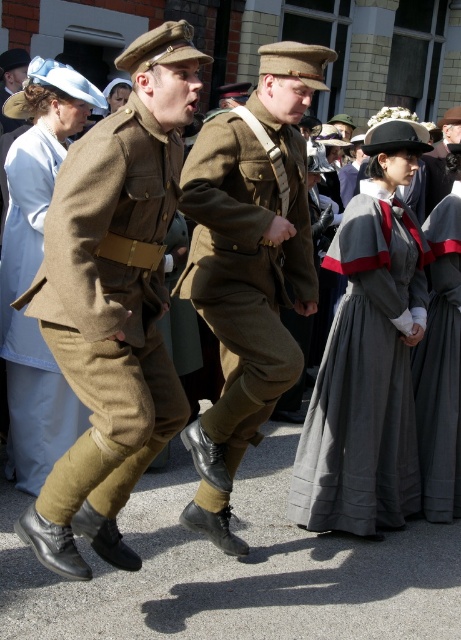
Can you confirm if matte brown uniform at center is positioned to the left of dark gray cotton dress at center?

Indeed, matte brown uniform at center is positioned on the left side of dark gray cotton dress at center.

Consider the image. Can you confirm if matte brown uniform at center is thinner than dark gray cotton dress at center?

Incorrect, matte brown uniform at center's width is not less than dark gray cotton dress at center's.

Image resolution: width=461 pixels, height=640 pixels. Find the location of `matte brown uniform at center`. matte brown uniform at center is located at coordinates (112, 301).

Looking at this image, is matte brown uniform at center thinner than khaki wool uniform at center?

No.

Where is `matte brown uniform at center`? matte brown uniform at center is located at coordinates (112, 301).

Does khaki wool uniform at center appear under gray cotton dress at center?

No, khaki wool uniform at center is not below gray cotton dress at center.

Does khaki wool uniform at center have a lesser width compared to gray cotton dress at center?

Correct, khaki wool uniform at center's width is less than gray cotton dress at center's.

Is point (312, 282) in front of point (378, 442)?

Yes, point (312, 282) is in front of point (378, 442).

The width and height of the screenshot is (461, 640). Find the location of `khaki wool uniform at center`. khaki wool uniform at center is located at coordinates (248, 266).